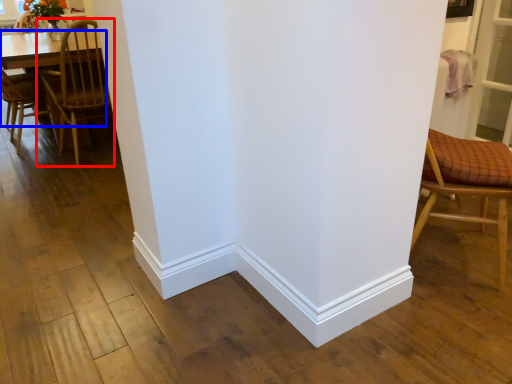
Question: Which object is closer to the camera taking this photo, chair (highlighted by a red box) or table (highlighted by a blue box)?

Choices:
 (A) chair
 (B) table

Answer: (A)